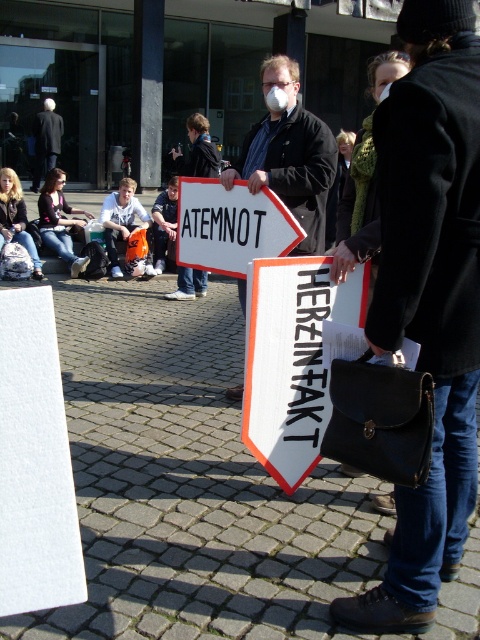
You are a photographer trying to capture the protest scene. You notice the white plastic sign at center and the white cotton shirt at center. Which object should you focus on to ensure it fits entirely within your camera frame without cropping?

The white plastic sign at center occupies less space than the white cotton shirt at center, so focusing on the white plastic sign at center will ensure it fits entirely within the camera frame without cropping.

In the protest scene, you see a white plastic sign at center and a white cotton shirt at center. Which object is positioned to the right of the other?

The white plastic sign at center is to the right of the white cotton shirt at center.

You are a photographer trying to capture the protest scene. You notice the white plastic sign at center and the jeans at lower left. Which object is located to the right of the other?

The white plastic sign at center is positioned on the right side of jeans at lower left.